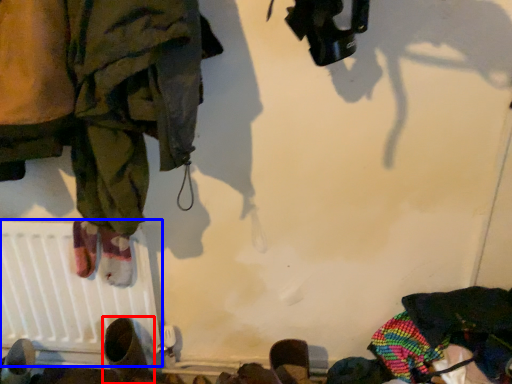
Question: Which point is further to the camera, footwear (highlighted by a red box) or radiator (highlighted by a blue box)?

Choices:
 (A) footwear
 (B) radiator

Answer: (B)